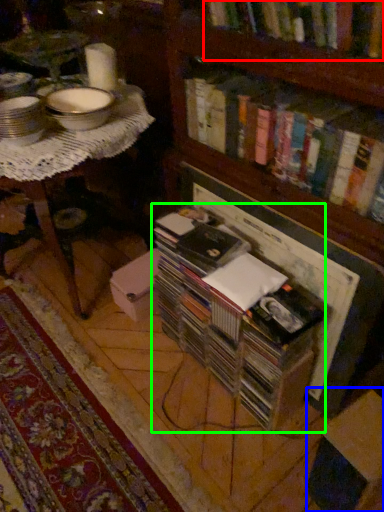
Question: Estimate the real-world distances between objects in this image. Which object is closer to book (highlighted by a red box), cardboard box (highlighted by a blue box) or book (highlighted by a green box)?

Choices:
 (A) cardboard box
 (B) book

Answer: (B)